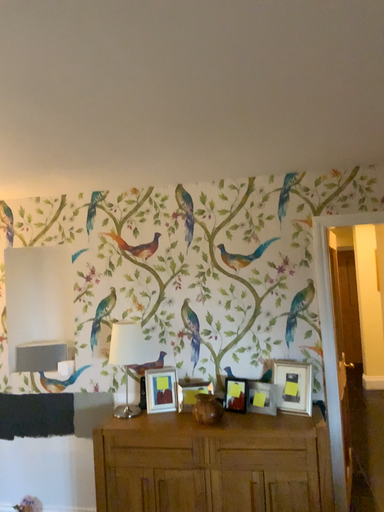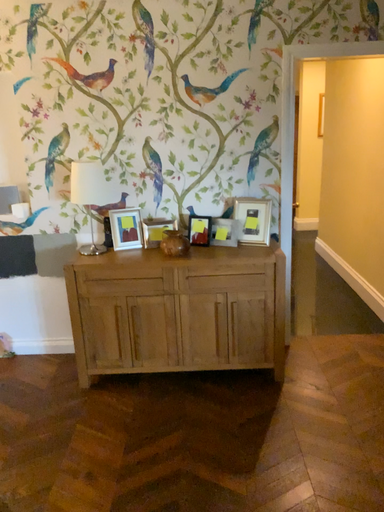
Question: Which way did the camera rotate in the video?

Choices:
 (A) rotated downward
 (B) rotated upward

Answer: (A)